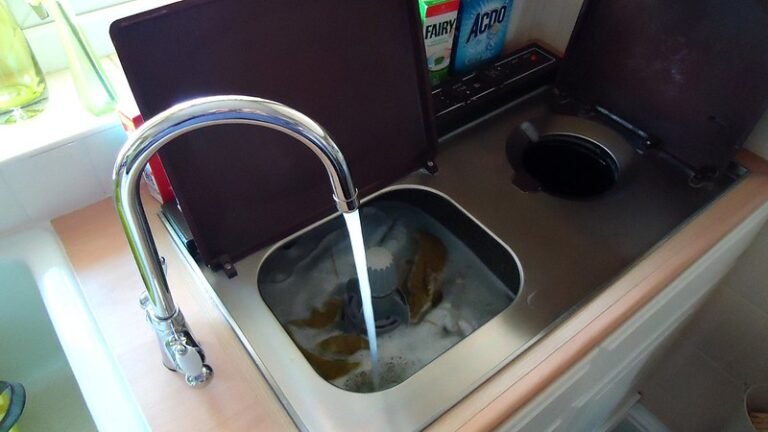
Locate an element on the screen. Image resolution: width=768 pixels, height=432 pixels. window is located at coordinates (60, 24).